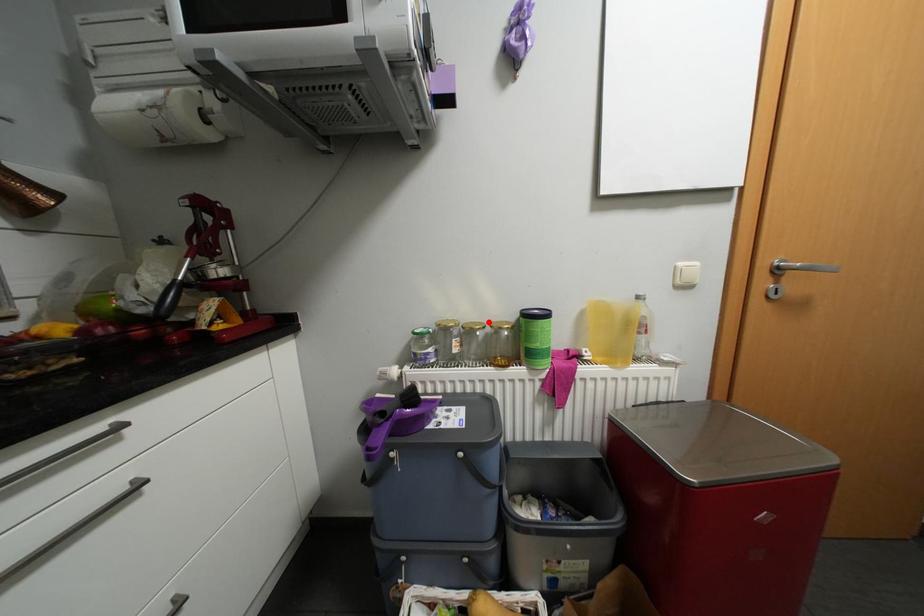
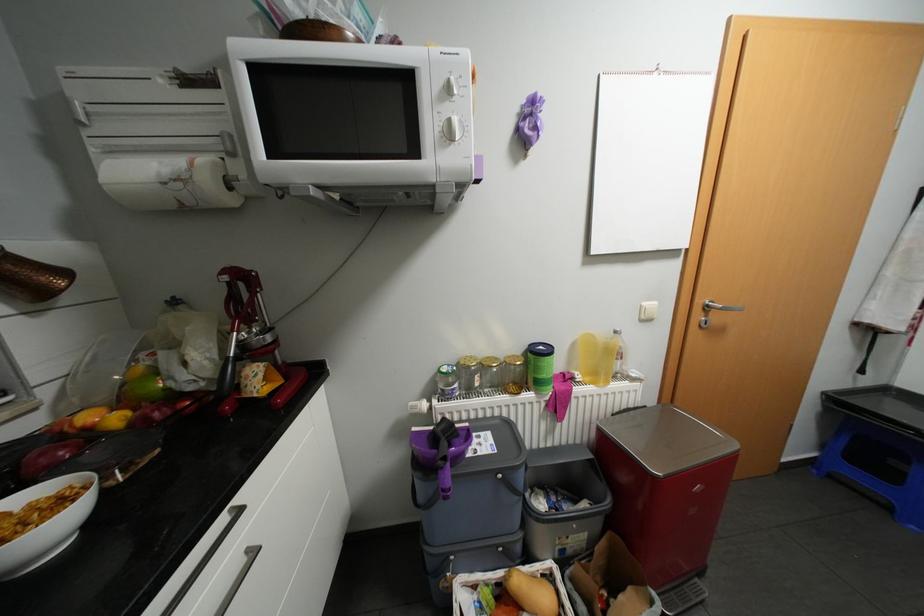
Where in the second image is the point corresponding to the highlighted location from the first image?

(504, 358)